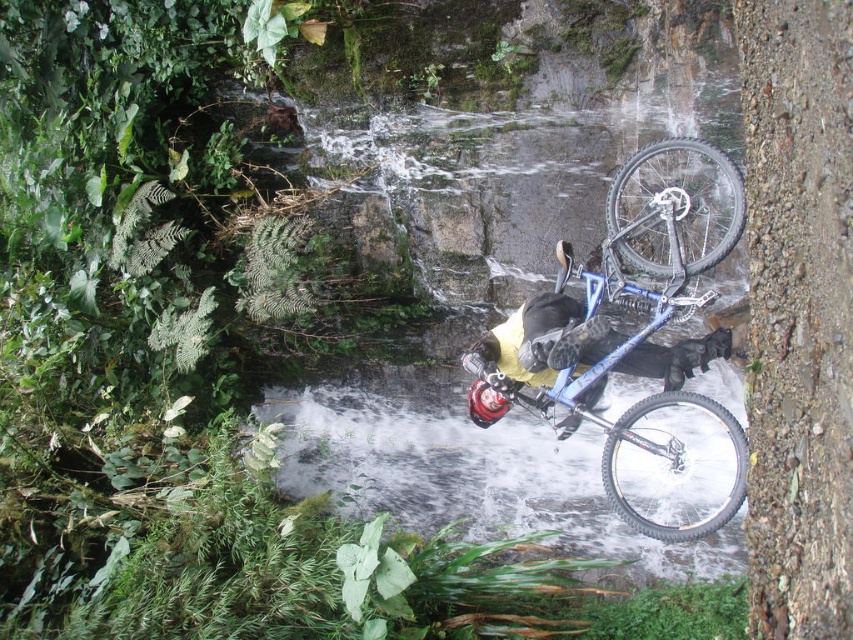
Question: Does blue metallic mountain bike at center have a larger size compared to clear water at center?

Choices:
 (A) yes
 (B) no

Answer: (B)

Question: Among these objects, which one is nearest to the camera?

Choices:
 (A) clear water at center
 (B) blue metallic mountain bike at center

Answer: (B)

Question: Can you confirm if blue metallic mountain bike at center is positioned above clear water at center?

Choices:
 (A) yes
 (B) no

Answer: (A)

Question: Which point is farther from the camera taking this photo?

Choices:
 (A) (560, 486)
 (B) (608, 253)

Answer: (A)

Question: In this image, where is blue metallic mountain bike at center located relative to clear water at center?

Choices:
 (A) right
 (B) left

Answer: (A)